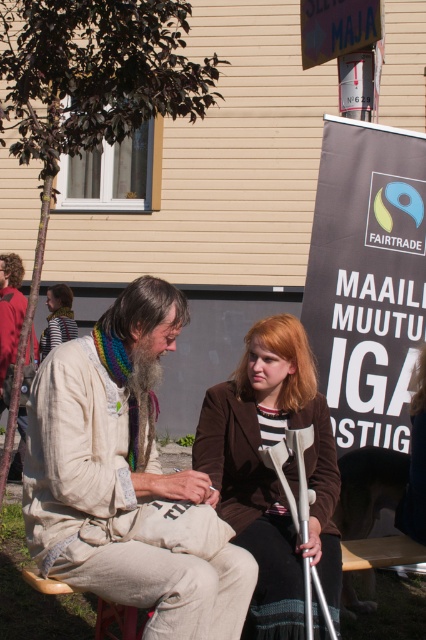
Who is more forward, (215, 424) or (5, 269)?

Positioned in front is point (215, 424).

Who is more distant from viewer, (x=276, y=484) or (x=22, y=266)?

Positioned behind is point (x=22, y=266).

Find the location of `brown fabric crutches at center`. brown fabric crutches at center is located at coordinates (273, 472).

Does light beige fabric jacket at center come in front of beige fabric jacket at lower left?

Yes.

Is light beige fabric jacket at center below beige fabric jacket at lower left?

Correct, light beige fabric jacket at center is located below beige fabric jacket at lower left.

Which is in front, point (40, 476) or point (25, 307)?

Point (40, 476) is in front.

Find the location of a particular element. This screenshot has height=640, width=426. light beige fabric jacket at center is located at coordinates (123, 476).

The height and width of the screenshot is (640, 426). What do you see at coordinates (123, 476) in the screenshot? I see `light beige fabric jacket at center` at bounding box center [123, 476].

Can you confirm if light beige fabric jacket at center is bigger than brown fabric crutches at center?

Indeed, light beige fabric jacket at center has a larger size compared to brown fabric crutches at center.

Does point (131, 387) come farther from viewer compared to point (311, 563)?

Yes, point (131, 387) is farther from viewer.

Locate an element on the screen. light beige fabric jacket at center is located at coordinates [x=123, y=476].